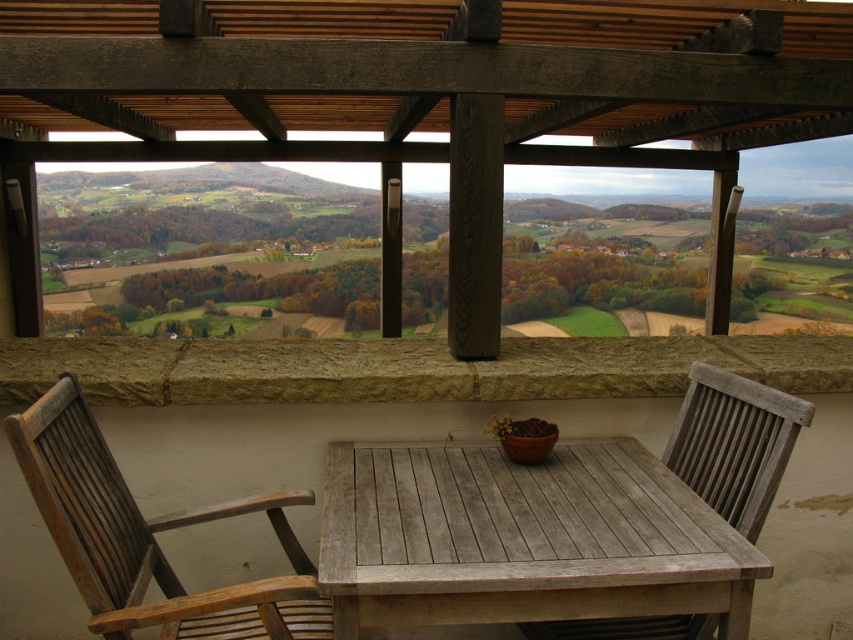
You are standing on the balcony and want to place a new potted plant exactly at the center of the weathered wood table at center. According to the coordinates provided, where should you place the plant?

The center of the weathered wood table at center is located at coordinates point (523, 538), so you should place the new potted plant at that exact point.

You are planning to place a large rectangular plant pot that is 1.2 meters in length on the weathered wood table at center and the wooden chair at lower left. Based on the size comparison between the two objects, which object can accommodate the pot without it hanging over the edges?

The weathered wood table at center is bigger than the wooden chair at lower left, so the large rectangular plant pot can be placed on the weathered wood table at center without it hanging over the edges.

You are standing at the edge of the balcony and want to place a small potted plant exactly at the center of the weathered wood table at center. According to the coordinates provided, where should you place the plant?

The weathered wood table at center is located at coordinates point (523, 538), so placing the plant at this exact point would center it on the table.